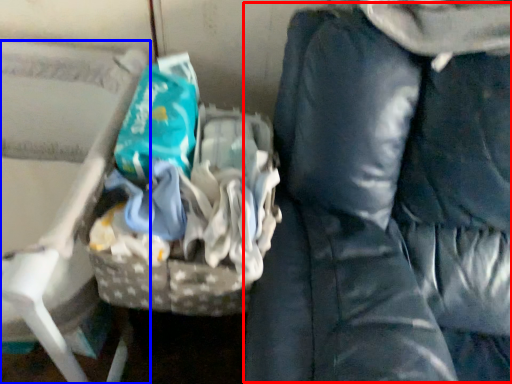
Question: Which point is closer to the camera, bean bag chair (highlighted by a red box) or furniture (highlighted by a blue box)?

Choices:
 (A) bean bag chair
 (B) furniture

Answer: (A)